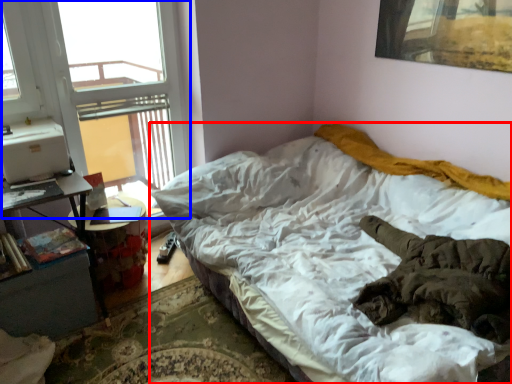
Question: Which object appears farthest to the camera in this image, bed (highlighted by a red box) or window (highlighted by a blue box)?

Choices:
 (A) bed
 (B) window

Answer: (B)